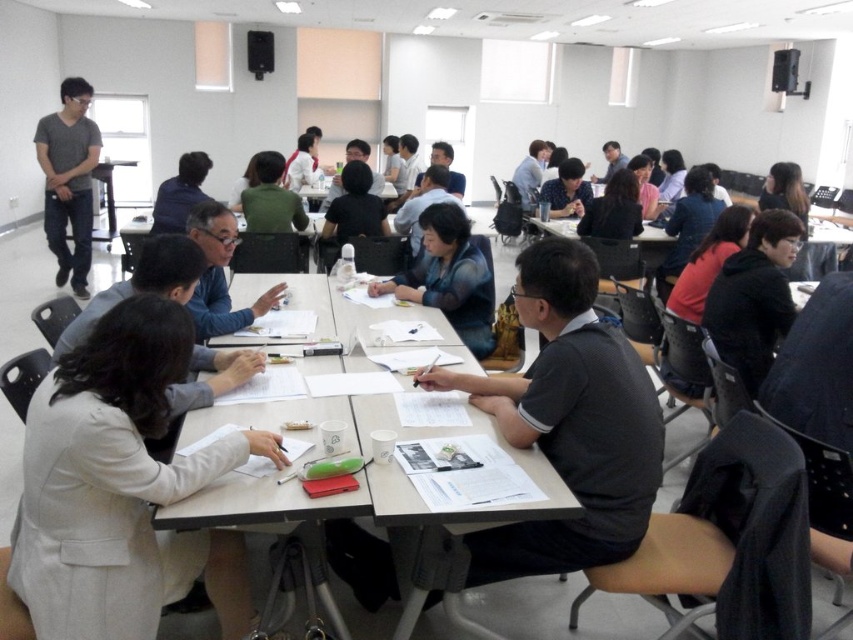
Between blue denim jacket at center and matte black shirt at center, which one is positioned lower?

blue denim jacket at center

The image size is (853, 640). Identify the location of blue denim jacket at center. (450, 276).

Find the location of a particular element. The image size is (853, 640). blue denim jacket at center is located at coordinates (450, 276).

Between gray cotton shirt at left and matte blue shirt at center, which one has less height?

matte blue shirt at center is shorter.

Is point (91, 214) less distant than point (173, 184)?

No, (91, 214) is behind (173, 184).

The width and height of the screenshot is (853, 640). What do you see at coordinates (68, 180) in the screenshot? I see `gray cotton shirt at left` at bounding box center [68, 180].

Locate an element on the screen. This screenshot has width=853, height=640. gray cotton shirt at left is located at coordinates (68, 180).

Based on the photo, is black matte jacket at right to the right of blue denim jacket at center from the viewer's perspective?

Correct, you'll find black matte jacket at right to the right of blue denim jacket at center.

This screenshot has width=853, height=640. Describe the element at coordinates (753, 296) in the screenshot. I see `black matte jacket at right` at that location.

Is point (764, 307) in front of point (436, 292)?

Yes, point (764, 307) is closer to viewer.

The image size is (853, 640). I want to click on black matte jacket at right, so click(x=753, y=296).